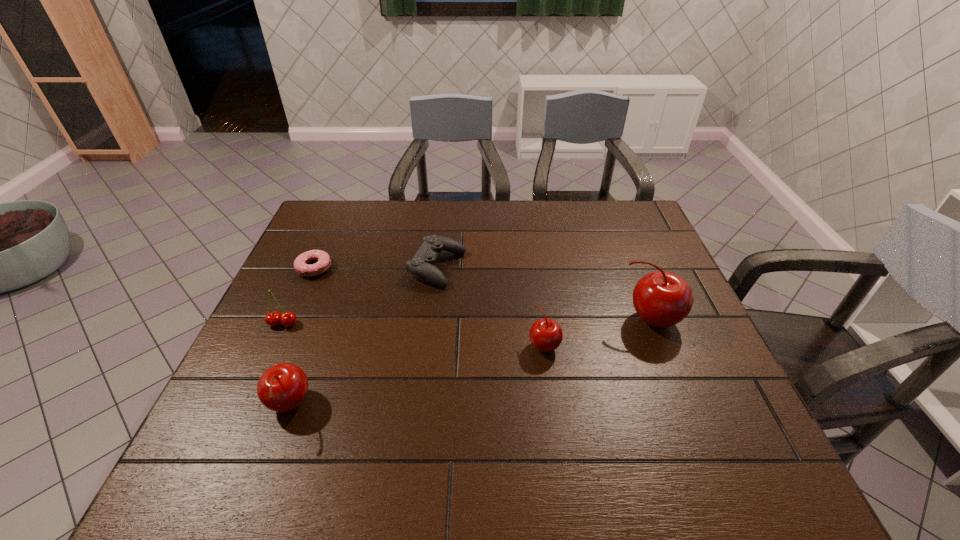
I want to click on vacant space in between the tallest cherry and the third object from right to left, so click(x=544, y=294).

Where is `vacant space in between the tallest cherry and the doughnut`? This screenshot has width=960, height=540. vacant space in between the tallest cherry and the doughnut is located at coordinates (483, 294).

Find the location of a particular element. free space between the leftmost cherry and the second cherry from right to left is located at coordinates click(x=414, y=334).

Find the location of a particular element. This screenshot has width=960, height=540. free space between the shortest object and the nearest cherry is located at coordinates (301, 337).

Locate which object ranks in proximity to the tallest cherry. Please provide its 2D coordinates. Your answer should be formatted as a tuple, i.e. [(x, y)], where the tuple contains the x and y coordinates of a point satisfying the conditions above.

[(546, 335)]

Identify which object is the fifth nearest to the shortest object. Please provide its 2D coordinates. Your answer should be formatted as a tuple, i.e. [(x, y)], where the tuple contains the x and y coordinates of a point satisfying the conditions above.

[(661, 299)]

Choose which cherry is the nearest neighbor to the leftmost cherry. Please provide its 2D coordinates. Your answer should be formatted as a tuple, i.e. [(x, y)], where the tuple contains the x and y coordinates of a point satisfying the conditions above.

[(283, 387)]

Identify which cherry is located as the third nearest to the leftmost cherry. Please provide its 2D coordinates. Your answer should be formatted as a tuple, i.e. [(x, y)], where the tuple contains the x and y coordinates of a point satisfying the conditions above.

[(661, 299)]

Find the location of a particular element. This screenshot has height=540, width=960. vacant space that satisfies the following two spatial constraints: 1. on the front side of the fourth object from left to right; 2. on the right side of the fifth object from left to right is located at coordinates (429, 345).

At what (x,y) coordinates should I click in order to perform the action: click on free location that satisfies the following two spatial constraints: 1. with the stems of the leftmost cherry pointing upwards; 2. on the right side of the second cherry from left to right. Please return your answer as a coordinate pair (x, y). Looking at the image, I should click on (246, 406).